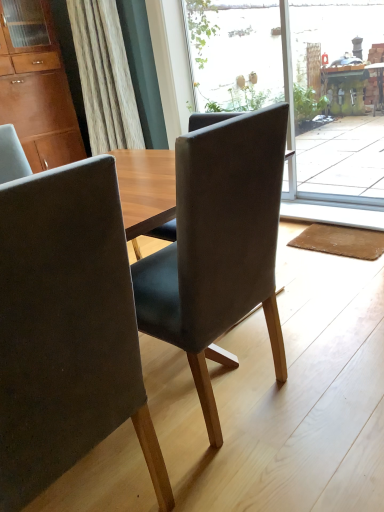
Find the location of a particular element. vacant area on top of brown fabric mat at lower right (from a real-world perspective) is located at coordinates (333, 236).